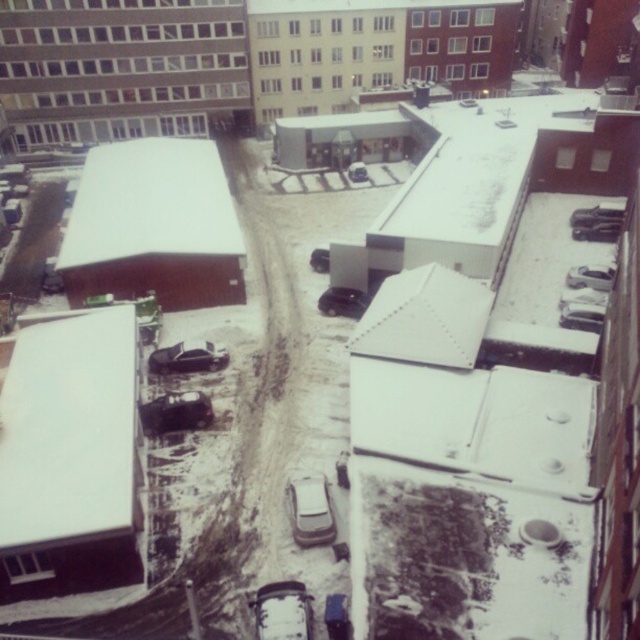
You are standing on the balcony looking at the snow scene. You see a white matte car at center and a shiny silver car at lower left. Which car is closer to you?

The white matte car at center is closer to you because it is in front of the shiny silver car at lower left.

You are standing on a balcony overlooking the snow scene. You see a white matte car at lower center and a satin black car at center. Which car is positioned lower in the scene?

The white matte car at lower center is positioned lower than the satin black car at center.

You are standing on the rooftop and want to walk from the white matte car at center to the matte black car at center. Which direction should you move relative to the cars?

You should move to the right relative to the white matte car at center because the white matte car at center is to the left of the matte black car at center.